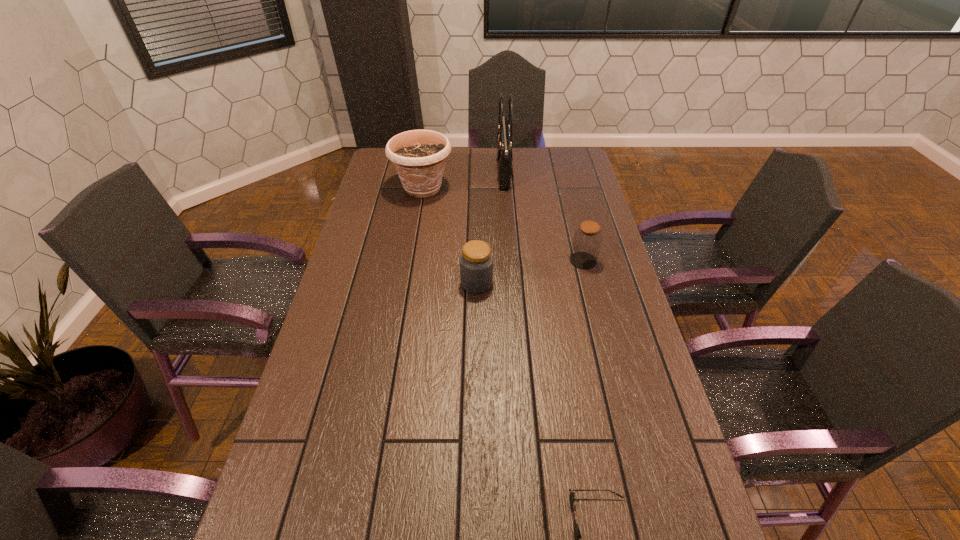
Where is `blank area at the right edge`? Image resolution: width=960 pixels, height=540 pixels. blank area at the right edge is located at coordinates (621, 491).

The height and width of the screenshot is (540, 960). Identify the location of vacant space at the far right corner of the desktop. (572, 166).

Locate an element on the screen. vacant area that lies between the handbag and the second nearest object is located at coordinates coord(490,227).

Find the location of a particular element. Image resolution: width=960 pixels, height=540 pixels. empty location between the leftmost object and the farther jar is located at coordinates (503, 225).

The height and width of the screenshot is (540, 960). Find the location of `free space between the left jar and the flowerpot`. free space between the left jar and the flowerpot is located at coordinates (449, 236).

Locate an element on the screen. This screenshot has height=540, width=960. free spot between the fourth object from right to left and the leftmost object is located at coordinates (449, 236).

Find the location of a particular element. free spot between the third object from left to right and the leftmost object is located at coordinates (463, 180).

Where is `vacant region between the leftmost object and the farther jar`? vacant region between the leftmost object and the farther jar is located at coordinates (503, 225).

What are the coordinates of `object that ranks as the closest to the sunglasses` in the screenshot? It's located at (476, 261).

The height and width of the screenshot is (540, 960). Identify the location of object that is the closest to the flowerpot. (504, 134).